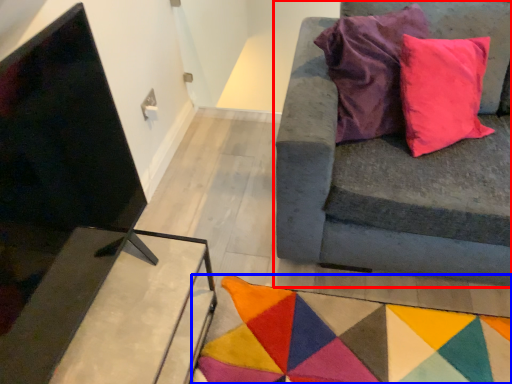
Question: Which point is closer to the camera, studio couch (highlighted by a red box) or mat (highlighted by a blue box)?

Choices:
 (A) studio couch
 (B) mat

Answer: (A)